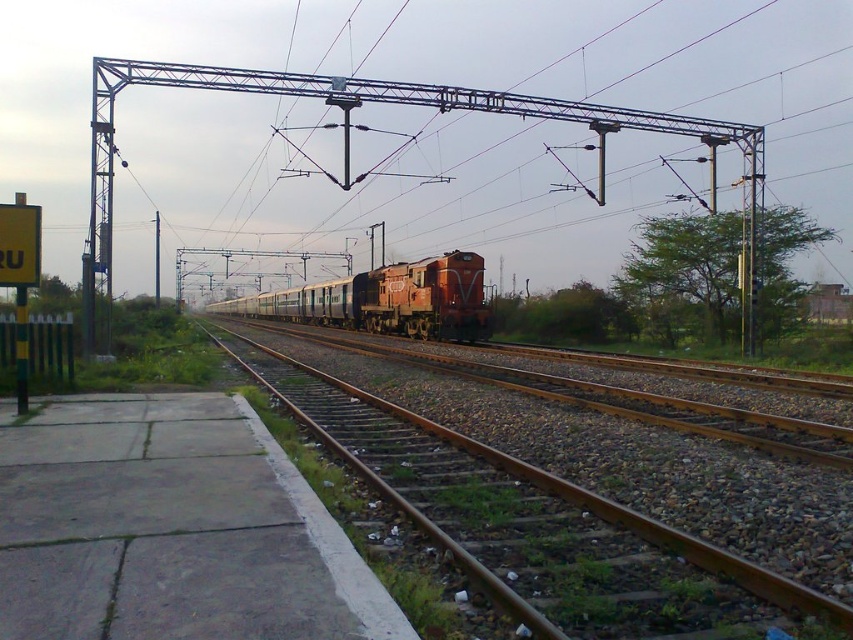
You are a drone operator trying to capture a photo of the brown metal train track at center from above. The camera is currently positioned at point A. To ensure the photo includes the entire track, you need to adjust the camera to point towards a specific coordinate. What is the exact coordinate you should aim for?

The exact coordinate to aim for is point (532,520), as that is where the brown metal train track at center is located.

You are a railway engineer inspecting the tracks. You need to locate the brown metal train track at center for maintenance. According to the coordinates provided, where exactly should you look on the image?

The brown metal train track at center is located at point (x=532, y=520), so you should look there for maintenance.

You are a railway engineer inspecting the tracks. You notice the matte red locomotive at center and the metallic pole at left. Based on their positions, which object is directly above the other?

The metallic pole at left is directly above the matte red locomotive at center because the locomotive is positioned under the pole.